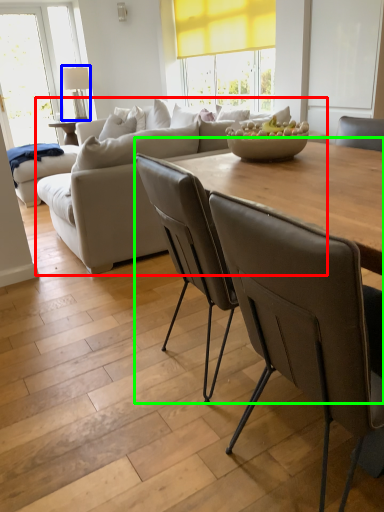
Question: Considering the real-world distances, which object is closest to studio couch (highlighted by a red box)? lamp (highlighted by a blue box) or table (highlighted by a green box).

Choices:
 (A) lamp
 (B) table

Answer: (B)